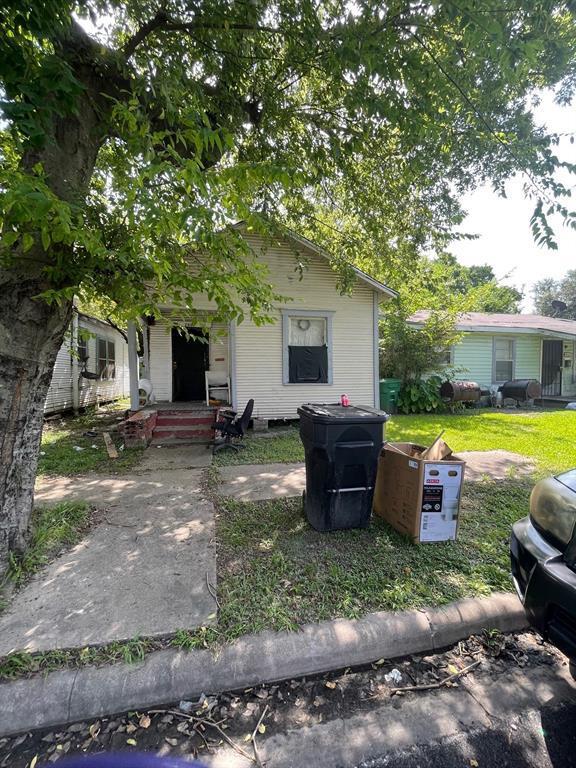
Find the location of a particular element. window is located at coordinates (310, 362).